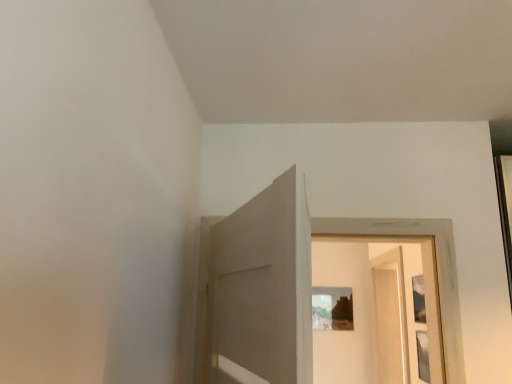
At what (x,y) coordinates should I click in order to perform the action: click on clear glass screen door at center. Please return your answer as a coordinate pair (x, y). Looking at the image, I should click on (391, 317).

Measure the distance between clear glass screen door at center and camera.

clear glass screen door at center and camera are 6.99 feet apart from each other.

Describe the element at coordinates (391, 317) in the screenshot. I see `clear glass screen door at center` at that location.

The image size is (512, 384). I want to click on matte wooden picture frame at center, so click(x=332, y=308).

The height and width of the screenshot is (384, 512). Describe the element at coordinates (332, 308) in the screenshot. I see `matte wooden picture frame at center` at that location.

At what (x,y) coordinates should I click in order to perform the action: click on clear glass screen door at center. Please return your answer as a coordinate pair (x, y). Looking at the image, I should click on (391, 317).

Is matte wooden picture frame at center at the right side of clear glass screen door at center?

Incorrect, matte wooden picture frame at center is not on the right side of clear glass screen door at center.

Which object is further away from the camera taking this photo, matte wooden picture frame at center or clear glass screen door at center?

Positioned behind is matte wooden picture frame at center.

Which is closer, (x=340, y=312) or (x=389, y=257)?

Point (x=340, y=312) is farther from the camera than point (x=389, y=257).

From the image's perspective, which one is positioned lower, matte wooden picture frame at center or clear glass screen door at center?

matte wooden picture frame at center is shown below in the image.

From a real-world perspective, is matte wooden picture frame at center on top of clear glass screen door at center?

Yes.

Is matte wooden picture frame at center wider than clear glass screen door at center?

No, matte wooden picture frame at center is not wider than clear glass screen door at center.

Considering the relative sizes of matte wooden picture frame at center and clear glass screen door at center in the image provided, is matte wooden picture frame at center shorter than clear glass screen door at center?

Yes, matte wooden picture frame at center is shorter than clear glass screen door at center.

Who is smaller, matte wooden picture frame at center or clear glass screen door at center?

Smaller between the two is matte wooden picture frame at center.

Can we say matte wooden picture frame at center lies outside clear glass screen door at center?

Yes, matte wooden picture frame at center is not within clear glass screen door at center.

Is matte wooden picture frame at center touching clear glass screen door at center?

No.

Is matte wooden picture frame at center aimed at clear glass screen door at center?

Yes, matte wooden picture frame at center is oriented towards clear glass screen door at center.

The image size is (512, 384). Find the location of `screen door on the right of matte wooden picture frame at center`. screen door on the right of matte wooden picture frame at center is located at coordinates (391, 317).

Which is more to the left, clear glass screen door at center or matte wooden picture frame at center?

From the viewer's perspective, matte wooden picture frame at center appears more on the left side.

Consider the image. Is the position of clear glass screen door at center more distant than that of matte wooden picture frame at center?

No, clear glass screen door at center is in front of matte wooden picture frame at center.

Which is closer to the camera, (395,376) or (344,297)?

Point (395,376) is positioned closer to the camera compared to point (344,297).

From the image's perspective, is clear glass screen door at center positioned above or below matte wooden picture frame at center?

Clearly, from the image's perspective, clear glass screen door at center is above matte wooden picture frame at center.

From a real-world perspective, is clear glass screen door at center positioned above or below matte wooden picture frame at center?

clear glass screen door at center is situated lower than matte wooden picture frame at center in the real world.

Between clear glass screen door at center and matte wooden picture frame at center, which one has larger width?

clear glass screen door at center is wider.

Considering the sizes of objects clear glass screen door at center and matte wooden picture frame at center in the image provided, who is shorter, clear glass screen door at center or matte wooden picture frame at center?

With less height is matte wooden picture frame at center.

Is clear glass screen door at center smaller than matte wooden picture frame at center?

No, clear glass screen door at center is not smaller than matte wooden picture frame at center.

Is clear glass screen door at center outside of matte wooden picture frame at center?

Yes, clear glass screen door at center is outside of matte wooden picture frame at center.

Is clear glass screen door at center touching matte wooden picture frame at center?

No, clear glass screen door at center is not beside matte wooden picture frame at center.

Is clear glass screen door at center oriented towards matte wooden picture frame at center?

Yes.

How different are the orientations of clear glass screen door at center and matte wooden picture frame at center in degrees?

The facing directions of clear glass screen door at center and matte wooden picture frame at center are 90.8 degrees apart.

Consider the image. How distant is clear glass screen door at center from matte wooden picture frame at center?

47.47 centimeters.

Find the location of a particular element. picture frame on the left of clear glass screen door at center is located at coordinates (332, 308).

The image size is (512, 384). I want to click on picture frame that appears below the clear glass screen door at center (from the image's perspective), so click(x=332, y=308).

This screenshot has width=512, height=384. I want to click on picture frame behind the clear glass screen door at center, so [x=332, y=308].